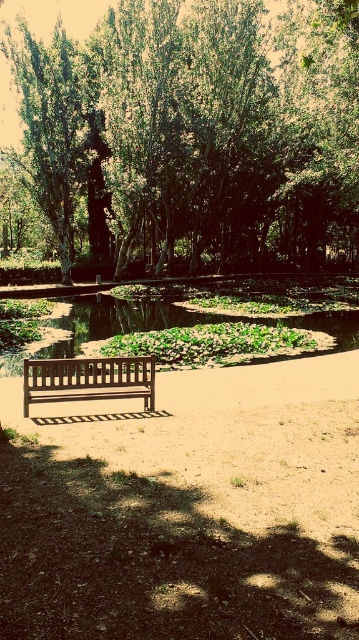
Locate an element on the screen. The width and height of the screenshot is (359, 640). green leafy pond at center is located at coordinates (184, 321).

Who is more distant from viewer, (338, 314) or (36, 385)?

Positioned behind is point (338, 314).

This screenshot has height=640, width=359. What are the coordinates of `green leafy pond at center` in the screenshot? It's located at (184, 321).

Who is more distant from viewer, [255,237] or [226,317]?

Positioned behind is point [255,237].

Does green leafy tree at upper center appear over green leafy pond at center?

Indeed, green leafy tree at upper center is positioned over green leafy pond at center.

Which is in front, point (114, 250) or point (173, 323)?

Point (173, 323) is in front.

The height and width of the screenshot is (640, 359). In order to click on green leafy tree at upper center in this screenshot , I will do `click(192, 132)`.

How far apart are green leafy tree at upper center and wooden bench at center?

The distance of green leafy tree at upper center from wooden bench at center is 34.95 meters.

In the scene shown: Does green leafy tree at upper center have a smaller size compared to wooden bench at center?

Incorrect, green leafy tree at upper center is not smaller in size than wooden bench at center.

I want to click on green leafy tree at upper center, so click(x=192, y=132).